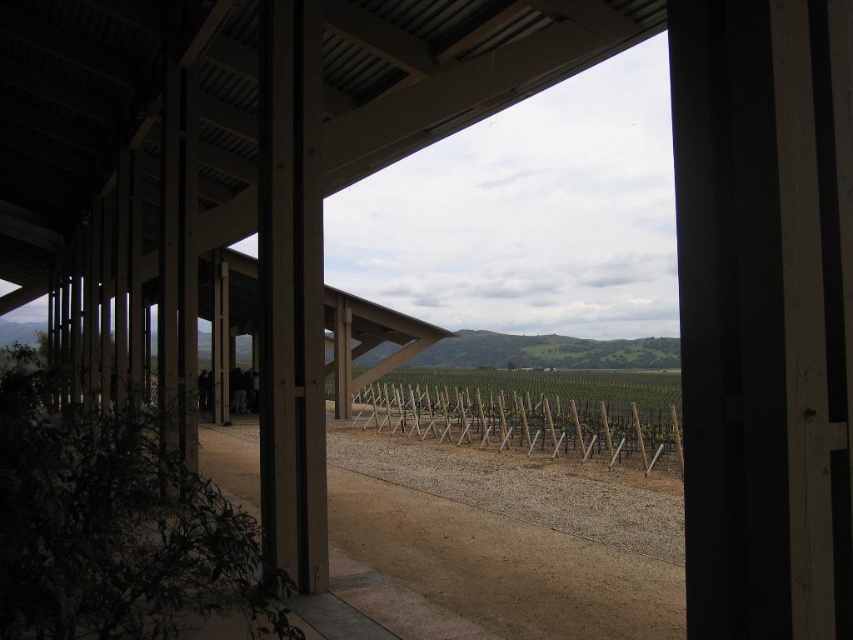
Who is more forward, (285, 72) or (518, 410)?

Point (285, 72) is in front.

What do you see at coordinates (291, 292) in the screenshot? I see `smooth wood pillar at center` at bounding box center [291, 292].

Image resolution: width=853 pixels, height=640 pixels. I want to click on smooth wood pillar at center, so click(291, 292).